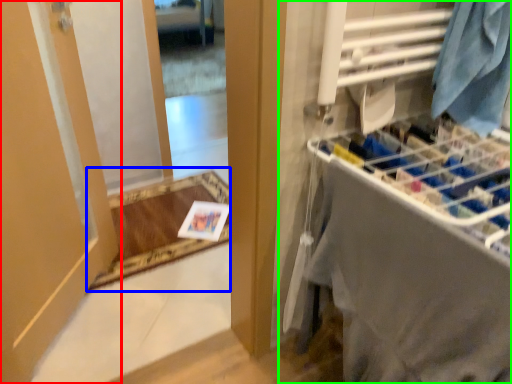
Question: Considering the real-world distances, which object is closest to door (highlighted by a red box)? mat (highlighted by a blue box) or closet (highlighted by a green box).

Choices:
 (A) mat
 (B) closet

Answer: (A)